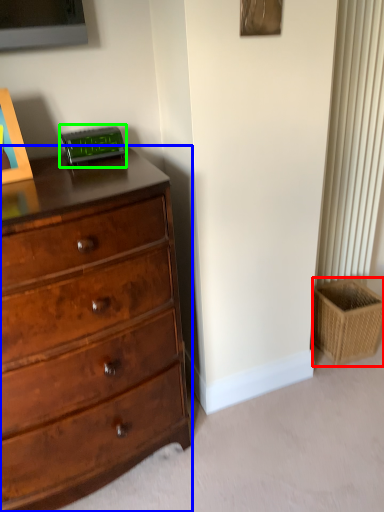
Question: Which object is the farthest from basket (highlighted by a red box)? Choose among these: chest of drawers (highlighted by a blue box) or alarm clock (highlighted by a green box).

Choices:
 (A) chest of drawers
 (B) alarm clock

Answer: (B)